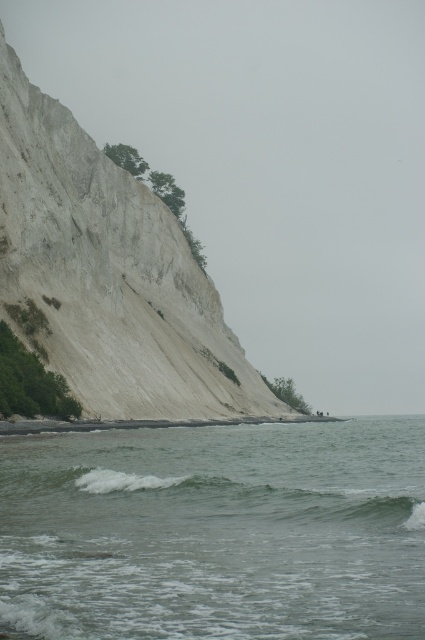
Question: Can you confirm if greenish water at lower center is bigger than green matte wave at lower center?

Choices:
 (A) yes
 (B) no

Answer: (A)

Question: Is white sandy cliff at upper left further to the viewer compared to green matte wave at lower center?

Choices:
 (A) yes
 (B) no

Answer: (A)

Question: Which point is farther to the camera?

Choices:
 (A) green matte wave at lower center
 (B) greenish water at lower center

Answer: (A)

Question: Observing the image, what is the correct spatial positioning of greenish water at lower center in reference to white sandy cliff at upper left?

Choices:
 (A) above
 (B) below

Answer: (B)

Question: Which point is closer to the camera?

Choices:
 (A) greenish water at lower center
 (B) green matte wave at lower center

Answer: (A)

Question: Which of these objects is positioned farthest from the green matte wave at lower center?

Choices:
 (A) white sandy cliff at upper left
 (B) greenish water at lower center

Answer: (A)